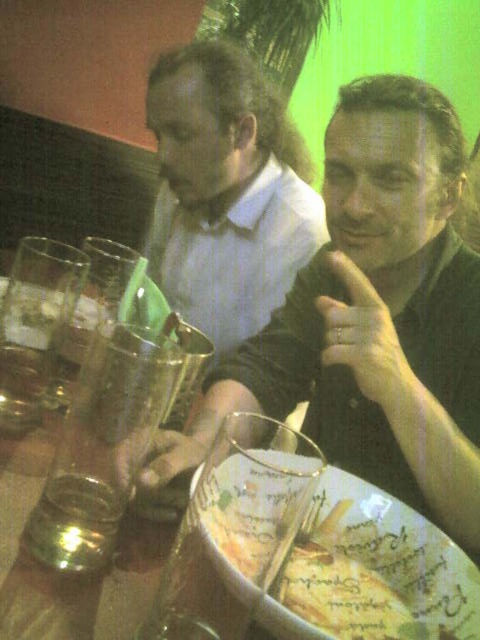
Question: Which object is farther from the camera taking this photo?

Choices:
 (A) matte white shirt at center
 (B) matte black shirt at center

Answer: (A)

Question: Does matte white shirt at center appear over decorative ceramic plate at center?

Choices:
 (A) no
 (B) yes

Answer: (B)

Question: Which point appears closest to the camera in this image?

Choices:
 (A) (74, 486)
 (B) (213, 291)
 (C) (332, 476)
 (D) (396, 198)

Answer: (A)

Question: Can you confirm if matte black shirt at center is thinner than matte white shirt at center?

Choices:
 (A) no
 (B) yes

Answer: (B)

Question: Can you confirm if matte white shirt at center is positioned to the left of shiny metallic glass at table center?

Choices:
 (A) yes
 (B) no

Answer: (B)

Question: Which object appears farthest from the camera in this image?

Choices:
 (A) matte black shirt at center
 (B) shiny metallic glass at table center
 (C) matte white shirt at center
 (D) decorative ceramic plate at center

Answer: (C)